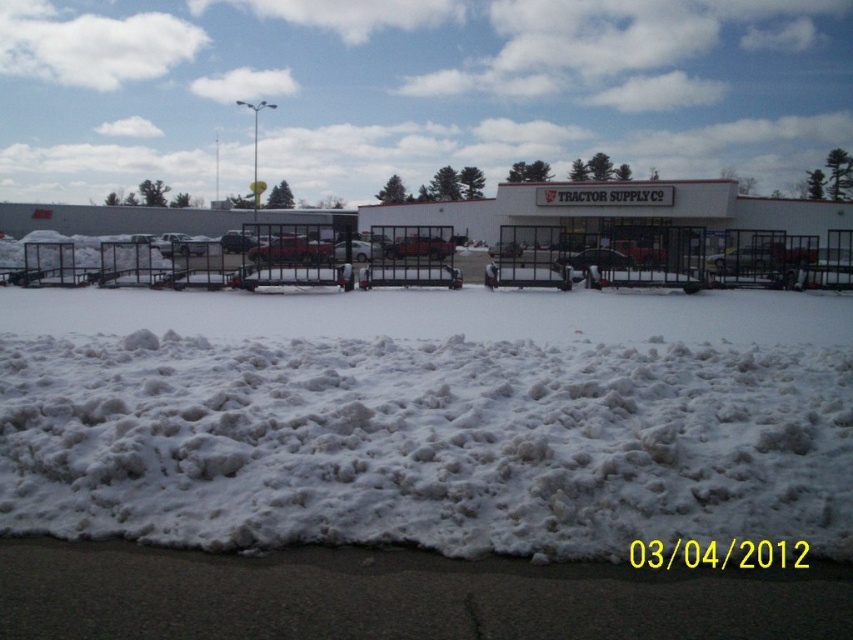
Can you confirm if white fluffy snow at lower center is thinner than matte red truck at center?

Correct, white fluffy snow at lower center's width is less than matte red truck at center's.

Who is more forward, (228, 493) or (299, 236)?

Point (228, 493) is more forward.

The image size is (853, 640). Identify the location of white fluffy snow at lower center. (424, 444).

Does matte red truck at center have a lesser height compared to metallic silver sedan at center?

Yes, matte red truck at center is shorter than metallic silver sedan at center.

Between matte red truck at center and metallic silver sedan at center, which one is positioned lower?

Positioned lower is matte red truck at center.

Is point (321, 243) closer to viewer compared to point (409, 237)?

Yes, it is.

Where is `matte red truck at center`? The height and width of the screenshot is (640, 853). matte red truck at center is located at coordinates (291, 250).

Is white fluffy snow at lower center to the left of metallic silver sedan at center from the viewer's perspective?

Indeed, white fluffy snow at lower center is positioned on the left side of metallic silver sedan at center.

Can you confirm if white fluffy snow at lower center is thinner than metallic silver sedan at center?

Indeed, white fluffy snow at lower center has a lesser width compared to metallic silver sedan at center.

Who is more distant from viewer, (103, 424) or (434, 237)?

The point (434, 237) is more distant.

You are a GUI agent. You are given a task and a screenshot of the screen. Output one action in this format:
    pyautogui.click(x=<x>, y=<y>)
    Task: Click on the white fluffy snow at lower center
    
    Given the screenshot: What is the action you would take?
    pyautogui.click(x=424, y=444)